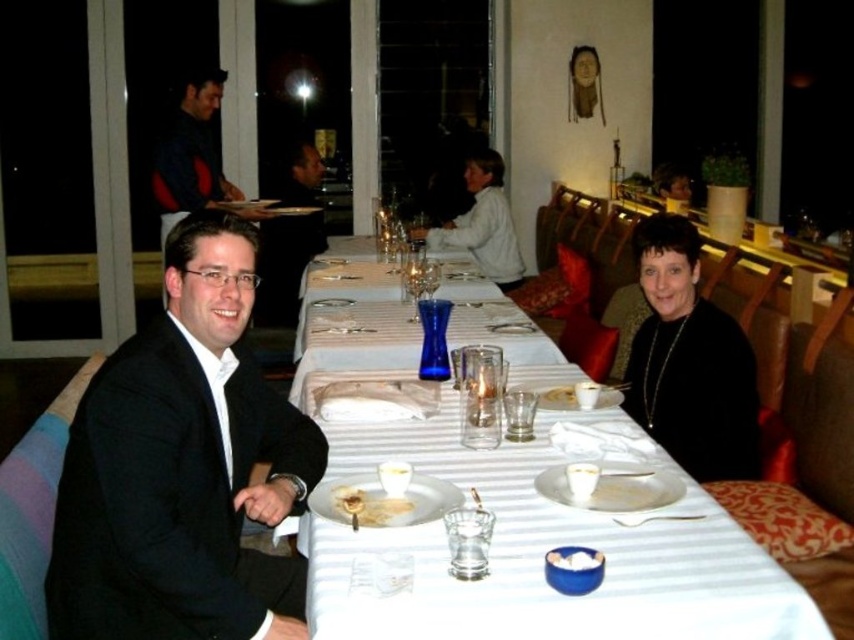
Who is positioned more to the left, white striped tablecloth at center or blue glass vase at center?

Positioned to the left is blue glass vase at center.

Can you confirm if white striped tablecloth at center is positioned above blue glass vase at center?

No.

Which is in front, point (414, 611) or point (494, 298)?

Positioned in front is point (414, 611).

Identify the location of white striped tablecloth at center. Image resolution: width=854 pixels, height=640 pixels. (544, 550).

Who is shorter, white sweater at center or white creamy food at center?

white creamy food at center is shorter.

Can you confirm if white sweater at center is wider than white creamy food at center?

Indeed, white sweater at center has a greater width compared to white creamy food at center.

Between point (442, 232) and point (595, 550), which one is positioned behind?

Point (442, 232)

This screenshot has height=640, width=854. In order to click on white sweater at center in this screenshot , I will do `click(483, 221)`.

Which is more to the right, black silk dress at center or white creamy food at center?

Positioned to the right is black silk dress at center.

Can you confirm if black silk dress at center is wider than white creamy food at center?

Correct, the width of black silk dress at center exceeds that of white creamy food at center.

At what (x,y) coordinates should I click in order to perform the action: click on black silk dress at center. Please return your answer as a coordinate pair (x, y). Looking at the image, I should click on (689, 360).

At what (x,y) coordinates should I click in order to perform the action: click on black silk dress at center. Please return your answer as a coordinate pair (x, y). This screenshot has height=640, width=854. Looking at the image, I should click on [689, 360].